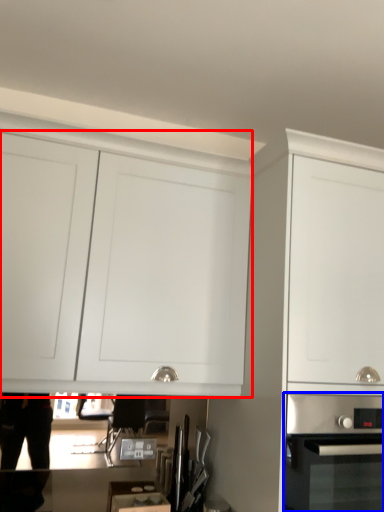
Question: Which point is further to the camera, cabinetry (highlighted by a red box) or home appliance (highlighted by a blue box)?

Choices:
 (A) cabinetry
 (B) home appliance

Answer: (A)